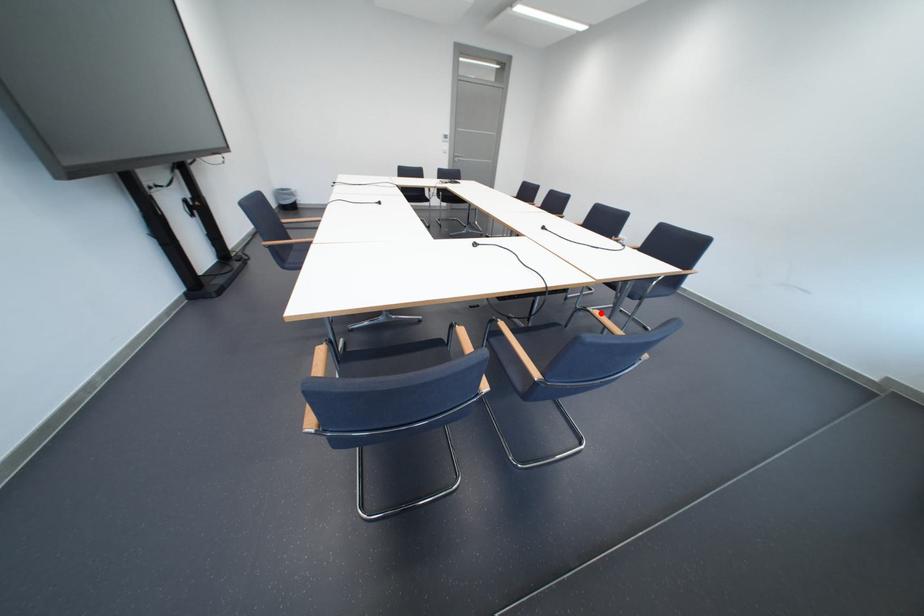
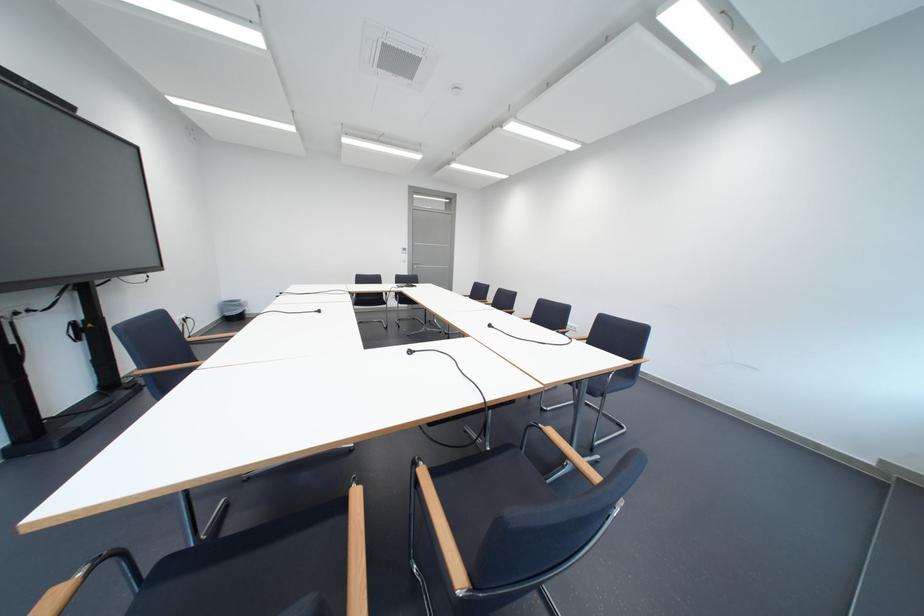
Question: I am providing you with two images of the same scene from different viewpoints. Image1 has a red point marked. In image2, the corresponding 3D location appears at what relative position? Reply with the corresponding letter.

Choices:
 (A) Closer
 (B) Farther

Answer: (A)